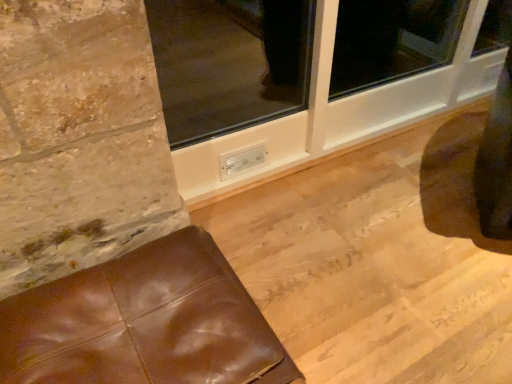
Locate an element on the screen. This screenshot has width=512, height=384. brown leather ottoman at lower left is located at coordinates (144, 323).

What do you see at coordinates (144, 323) in the screenshot? I see `brown leather ottoman at lower left` at bounding box center [144, 323].

This screenshot has height=384, width=512. Find the location of `white plastic window frame at lower center`. white plastic window frame at lower center is located at coordinates (302, 80).

Measure the distance between white plastic window frame at lower center and camera.

white plastic window frame at lower center and camera are 2.22 meters apart.

Measure the distance between point (384, 132) and camera.

The depth of point (384, 132) is 2.18 meters.

Image resolution: width=512 pixels, height=384 pixels. Describe the element at coordinates (302, 80) in the screenshot. I see `white plastic window frame at lower center` at that location.

Identify the location of brown leather ottoman at lower left. (144, 323).

In the image, is white plastic window frame at lower center on the left side or the right side of brown leather ottoman at lower left?

In the image, white plastic window frame at lower center appears on the right side of brown leather ottoman at lower left.

Is the position of white plastic window frame at lower center less distant than that of brown leather ottoman at lower left?

No, white plastic window frame at lower center is further to the viewer.

Is point (305, 23) farther from camera compared to point (91, 267)?

Yes.

From the image's perspective, relative to brown leather ottoman at lower left, is white plastic window frame at lower center above or below?

white plastic window frame at lower center is above brown leather ottoman at lower left.

From a real-world perspective, is white plastic window frame at lower center above or below brown leather ottoman at lower left?

white plastic window frame at lower center is situated higher than brown leather ottoman at lower left in the real world.

Consider the image. Considering the sizes of objects white plastic window frame at lower center and brown leather ottoman at lower left in the image provided, who is thinner, white plastic window frame at lower center or brown leather ottoman at lower left?

With smaller width is white plastic window frame at lower center.

In terms of height, does white plastic window frame at lower center look taller or shorter compared to brown leather ottoman at lower left?

Clearly, white plastic window frame at lower center is taller compared to brown leather ottoman at lower left.

Considering the relative sizes of white plastic window frame at lower center and brown leather ottoman at lower left in the image provided, is white plastic window frame at lower center bigger than brown leather ottoman at lower left?

Correct, white plastic window frame at lower center is larger in size than brown leather ottoman at lower left.

Is brown leather ottoman at lower left surrounded by white plastic window frame at lower center?

No, brown leather ottoman at lower left is not inside white plastic window frame at lower center.

Is there a large distance between white plastic window frame at lower center and brown leather ottoman at lower left?

white plastic window frame at lower center is far away from brown leather ottoman at lower left.

Is white plastic window frame at lower center aimed at brown leather ottoman at lower left?

Yes, white plastic window frame at lower center is turned towards brown leather ottoman at lower left.

Where is `window frame above the brown leather ottoman at lower left (from the image's perspective)`? The height and width of the screenshot is (384, 512). window frame above the brown leather ottoman at lower left (from the image's perspective) is located at coordinates (302, 80).

Considering the positions of objects brown leather ottoman at lower left and white plastic window frame at lower center in the image provided, who is more to the right, brown leather ottoman at lower left or white plastic window frame at lower center?

Positioned to the right is white plastic window frame at lower center.

Is brown leather ottoman at lower left positioned in front of white plastic window frame at lower center?

Yes, brown leather ottoman at lower left is in front of white plastic window frame at lower center.

Considering the points (74, 293) and (458, 47), which point is behind, point (74, 293) or point (458, 47)?

The point (458, 47) is more distant.

From the image's perspective, is brown leather ottoman at lower left beneath white plastic window frame at lower center?

Correct, brown leather ottoman at lower left appears lower than white plastic window frame at lower center in the image.

From a real-world perspective, is brown leather ottoman at lower left below white plastic window frame at lower center?

Yes, from a real-world perspective, brown leather ottoman at lower left is under white plastic window frame at lower center.

Which of these two, brown leather ottoman at lower left or white plastic window frame at lower center, is thinner?

white plastic window frame at lower center is thinner.

Can you confirm if brown leather ottoman at lower left is shorter than white plastic window frame at lower center?

Indeed, brown leather ottoman at lower left has a lesser height compared to white plastic window frame at lower center.

Considering the sizes of objects brown leather ottoman at lower left and white plastic window frame at lower center in the image provided, who is bigger, brown leather ottoman at lower left or white plastic window frame at lower center?

With larger size is white plastic window frame at lower center.

Is brown leather ottoman at lower left surrounding white plastic window frame at lower center?

That's incorrect, white plastic window frame at lower center is not inside brown leather ottoman at lower left.

Is brown leather ottoman at lower left in contact with white plastic window frame at lower center?

No, brown leather ottoman at lower left is not beside white plastic window frame at lower center.

Could you tell me if brown leather ottoman at lower left is turned towards white plastic window frame at lower center?

No.

Can you tell me how much brown leather ottoman at lower left and white plastic window frame at lower center differ in facing direction?

They differ by 0.692 degrees in their facing directions.

Locate an element on the screen. furniture in front of the white plastic window frame at lower center is located at coordinates (144, 323).

Image resolution: width=512 pixels, height=384 pixels. What are the coordinates of `window frame located behind the brown leather ottoman at lower left` in the screenshot? It's located at (302, 80).

Where is `furniture in front of the white plastic window frame at lower center`? The height and width of the screenshot is (384, 512). furniture in front of the white plastic window frame at lower center is located at coordinates (144, 323).